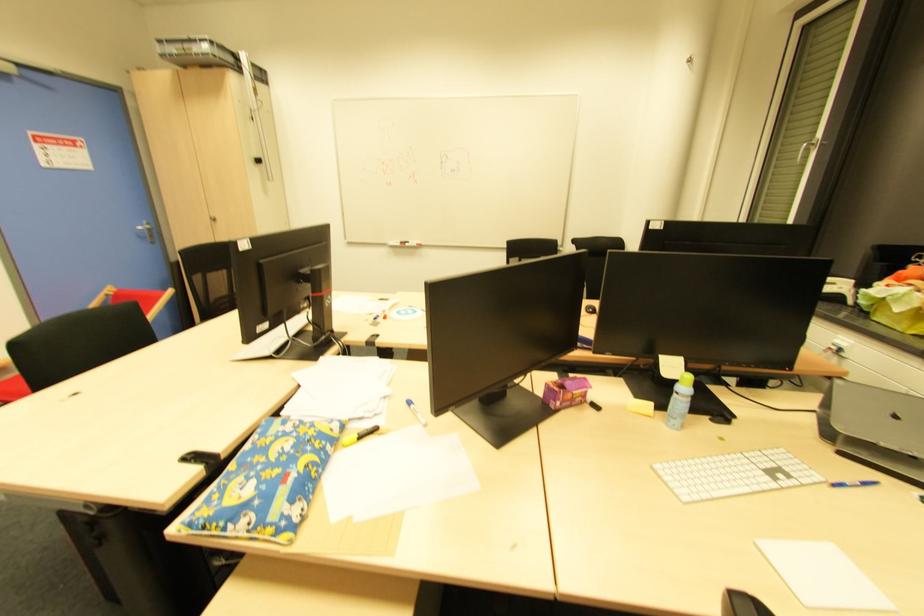
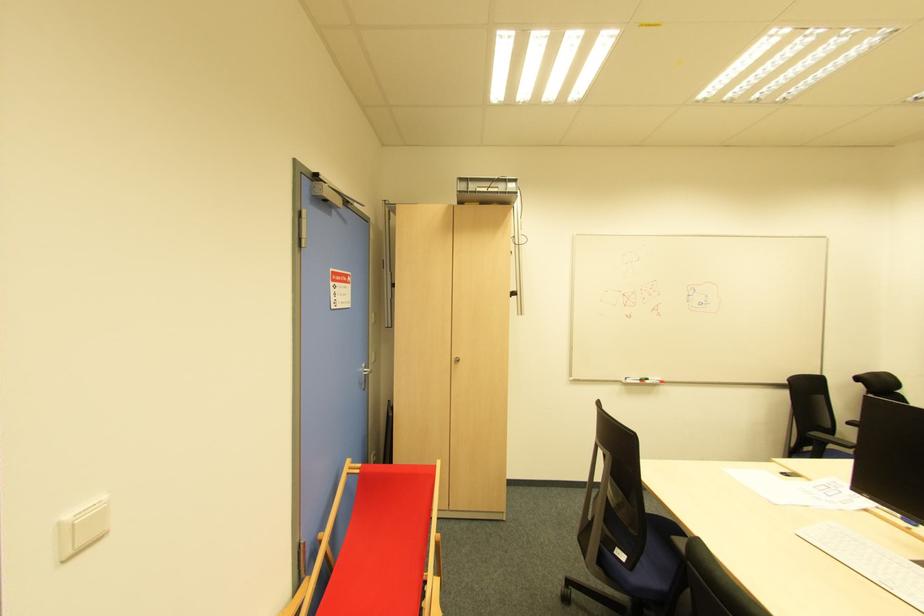
In the second image, find the point that corresponds to pixel 419 246 in the first image.

(662, 383)